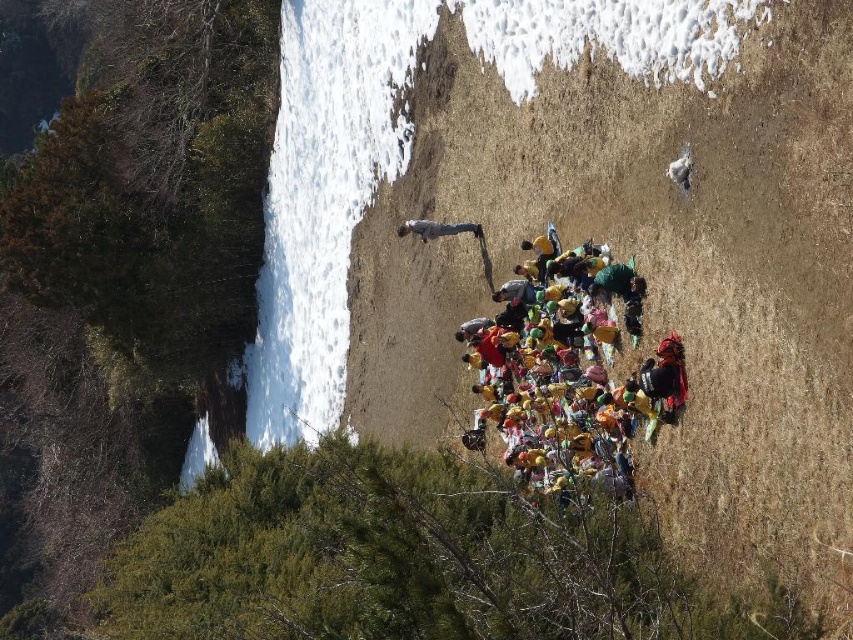
Consider the image. Is multicolored fabric at center shorter than light gray jeans at upper center?

No.

Consider the image. Is multicolored fabric at center further to camera compared to light gray jeans at upper center?

No, it is not.

Identify the location of multicolored fabric at center. (572, 378).